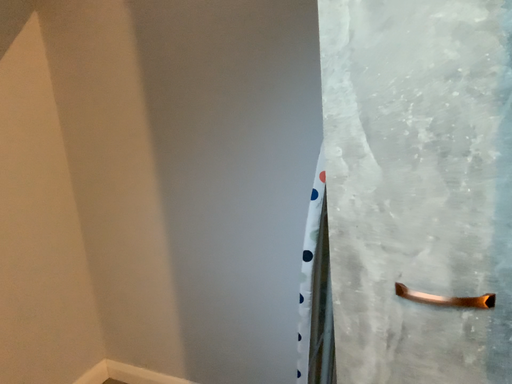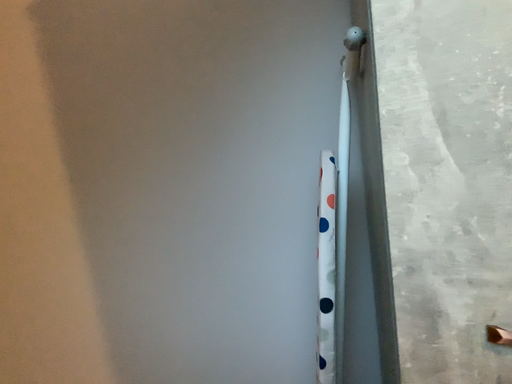
Question: Which way did the camera rotate in the video?

Choices:
 (A) rotated downward
 (B) rotated upward

Answer: (B)